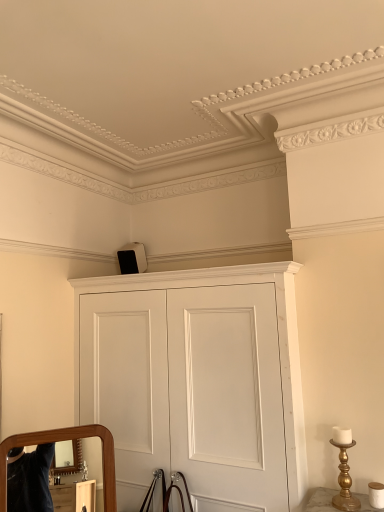
Question: Considering the positions of point (269, 415) and point (339, 494), is point (269, 415) closer or farther from the camera than point (339, 494)?

Choices:
 (A) closer
 (B) farther

Answer: (B)

Question: From the image's perspective, is white matte cupboard at upper center located above or below gold metallic candlestick at lower right?

Choices:
 (A) above
 (B) below

Answer: (A)

Question: From a real-world perspective, relative to gold metallic candlestick at lower right, is white matte cupboard at upper center vertically above or below?

Choices:
 (A) above
 (B) below

Answer: (A)

Question: In the image, is gold metallic candlestick at lower right on the left side or the right side of white matte cupboard at upper center?

Choices:
 (A) right
 (B) left

Answer: (A)

Question: In terms of size, does gold metallic candlestick at lower right appear bigger or smaller than white matte cupboard at upper center?

Choices:
 (A) big
 (B) small

Answer: (B)

Question: Is point (342, 446) closer or farther from the camera than point (225, 295)?

Choices:
 (A) closer
 (B) farther

Answer: (A)

Question: From the image's perspective, is gold metallic candlestick at lower right positioned above or below white matte cupboard at upper center?

Choices:
 (A) below
 (B) above

Answer: (A)